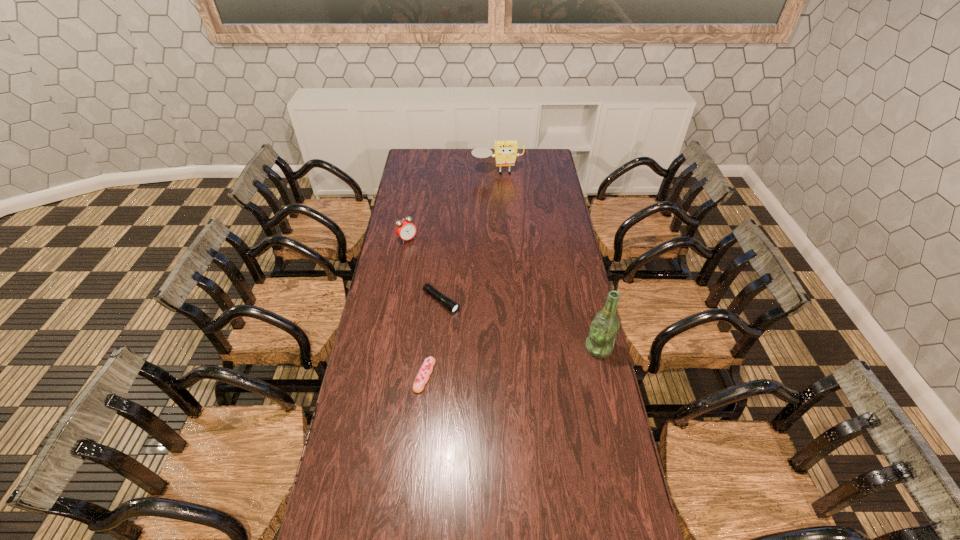
Find the location of a particular element. This screenshot has width=960, height=540. free space located on the surface of the rightmost object is located at coordinates (532, 348).

At what (x,y) coordinates should I click in order to perform the action: click on vacant point located on the surface of the rightmost object. Please return your answer as a coordinate pair (x, y). Image resolution: width=960 pixels, height=540 pixels. Looking at the image, I should click on (530, 348).

Locate an element on the screen. The height and width of the screenshot is (540, 960). vacant point located at the lens end of the third farthest object is located at coordinates (504, 348).

Locate an element on the screen. The height and width of the screenshot is (540, 960). free space located at the lens end of the third farthest object is located at coordinates (474, 326).

The width and height of the screenshot is (960, 540). I want to click on vacant space situated at the lens end of the third farthest object, so click(479, 329).

The image size is (960, 540). What are the coordinates of `vacant region located on the front-facing side of the third shortest object` in the screenshot? It's located at (422, 254).

This screenshot has height=540, width=960. What are the coordinates of `free location located 0.370m on the front-facing side of the third shortest object` in the screenshot? It's located at (455, 290).

You are a GUI agent. You are given a task and a screenshot of the screen. Output one action in this format:
    pyautogui.click(x=<x>, y=<y>)
    Task: Click on the vacant area located on the front-facing side of the third shortest object
    
    Given the screenshot: What is the action you would take?
    pyautogui.click(x=421, y=253)

Find the location of `vacant space located on the front-facing side of the farthest object`. vacant space located on the front-facing side of the farthest object is located at coordinates (507, 218).

The height and width of the screenshot is (540, 960). Identify the location of free location located on the front-facing side of the farthest object. (501, 187).